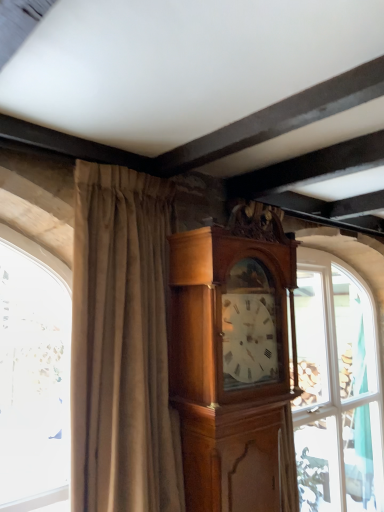
Locate an element on the screen. This screenshot has width=384, height=512. polished wood grandfather clock at center is located at coordinates [x=235, y=362].

This screenshot has height=512, width=384. What do you see at coordinates (235, 362) in the screenshot?
I see `polished wood grandfather clock at center` at bounding box center [235, 362].

Describe the element at coordinates (336, 390) in the screenshot. I see `clear glass window at center` at that location.

Where is `polished wood grandfather clock at center`? This screenshot has width=384, height=512. polished wood grandfather clock at center is located at coordinates (235, 362).

From the image's perspective, is polished wood grandfather clock at center positioned above or below beige velvet curtain at center?

Based on their image positions, polished wood grandfather clock at center is located beneath beige velvet curtain at center.

Between polished wood grandfather clock at center and beige velvet curtain at center, which one has less height?

Standing shorter between the two is polished wood grandfather clock at center.

Considering the points (264, 360) and (84, 355), which point is behind, point (264, 360) or point (84, 355)?

The point (264, 360) is more distant.

In the image, there is a clear glass window at center. Identify the location of cabinetry above it (from the image's perspective). Image resolution: width=384 pixels, height=512 pixels. (235, 362).

Is the position of polished wood grandfather clock at center more distant than that of clear glass window at center?

No, polished wood grandfather clock at center is closer to the camera.

From a real-world perspective, is polished wood grandfather clock at center located beneath clear glass window at center?

No, from a real-world perspective, polished wood grandfather clock at center is not beneath clear glass window at center.

Can you confirm if polished wood grandfather clock at center is taller than clear glass window at center?

Incorrect, the height of polished wood grandfather clock at center is not larger of that of clear glass window at center.

Based on the photo, is clear glass window at center turned away from beige velvet curtain at center?

That's not correct — clear glass window at center is not looking away from beige velvet curtain at center.

Is there a large distance between clear glass window at center and beige velvet curtain at center?

Indeed, clear glass window at center is not near beige velvet curtain at center.

From the image's perspective, is clear glass window at center above or below beige velvet curtain at center?

clear glass window at center is situated lower than beige velvet curtain at center in the image.

Considering the positions of objects clear glass window at center and beige velvet curtain at center in the image provided, who is more to the left, clear glass window at center or beige velvet curtain at center?

beige velvet curtain at center is more to the left.

Is clear glass window at center completely or partially inside beige velvet curtain at center?

No, clear glass window at center is not inside beige velvet curtain at center.

Between beige velvet curtain at center and clear glass window at center, which one has more height?

clear glass window at center.

Would you consider beige velvet curtain at center to be distant from clear glass window at center?

That's right, there is a large distance between beige velvet curtain at center and clear glass window at center.

Is beige velvet curtain at center closer to the viewer compared to clear glass window at center?

Yes, beige velvet curtain at center is closer to the viewer.

Is clear glass window at center to the right of polished wood grandfather clock at center from the viewer's perspective?

Correct, you'll find clear glass window at center to the right of polished wood grandfather clock at center.

Between clear glass window at center and polished wood grandfather clock at center, which one has smaller size?

Smaller between the two is polished wood grandfather clock at center.

Does clear glass window at center have a lesser height compared to polished wood grandfather clock at center?

No.

In the image, is beige velvet curtain at center on the left side or the right side of polished wood grandfather clock at center?

beige velvet curtain at center is positioned on polished wood grandfather clock at center's left side.

Does beige velvet curtain at center turn towards polished wood grandfather clock at center?

No, beige velvet curtain at center is not aimed at polished wood grandfather clock at center.

Identify the location of cabinetry that is below the beige velvet curtain at center (from the image's perspective). This screenshot has width=384, height=512. pyautogui.click(x=235, y=362).

At what (x,y) coordinates should I click in order to perform the action: click on curtain located above the polished wood grandfather clock at center (from a real-world perspective). Please return your answer as a coordinate pair (x, y). This screenshot has height=512, width=384. Looking at the image, I should click on click(x=122, y=345).

Locate an element on the screen. cabinetry lying above the clear glass window at center (from the image's perspective) is located at coordinates (235, 362).

Looking at the image, which one is located further to polished wood grandfather clock at center, clear glass window at center or beige velvet curtain at center?

Based on the image, clear glass window at center appears to be further to polished wood grandfather clock at center.

In the scene shown: Considering their positions, is clear glass window at center positioned further to beige velvet curtain at center than polished wood grandfather clock at center?

clear glass window at center.

From the image, which object appears to be farther from clear glass window at center, beige velvet curtain at center or polished wood grandfather clock at center?

beige velvet curtain at center.

Considering their positions, is polished wood grandfather clock at center positioned further to clear glass window at center than beige velvet curtain at center?

Based on the image, beige velvet curtain at center appears to be further to clear glass window at center.

Which object lies further to the anchor point beige velvet curtain at center, polished wood grandfather clock at center or clear glass window at center?

clear glass window at center is positioned further to the anchor beige velvet curtain at center.

Which object lies further to the anchor point polished wood grandfather clock at center, beige velvet curtain at center or clear glass window at center?

clear glass window at center lies further to polished wood grandfather clock at center than the other object.

This screenshot has width=384, height=512. Find the location of `cabinetry positioned between beige velvet curtain at center and clear glass window at center from near to far`. cabinetry positioned between beige velvet curtain at center and clear glass window at center from near to far is located at coordinates (235, 362).